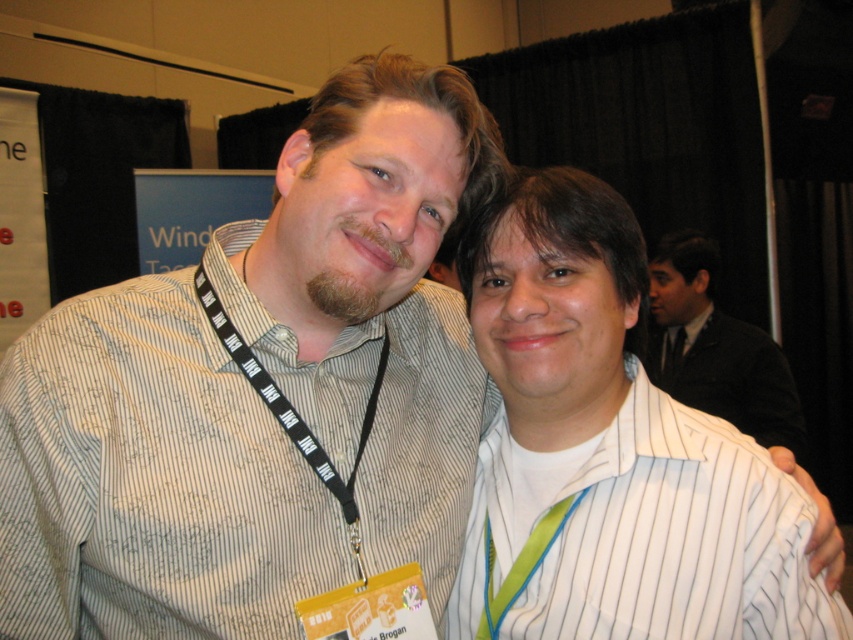
You are a photographer standing 1 meter away from the striped cotton shirt at center. Can you take a clear photo of it without moving closer?

The striped cotton shirt at center is 26.85 inches away from the viewer. Since 26.85 inches is approximately 0.68 meters, and you are already 1 meter away, you need to move closer to capture a clear photo.

You are a photographer at the event and want to ensure both subjects are fully visible in the photo. Is the striped cotton shirt at center overlapping with the black suit jacket at upper right?

The striped cotton shirt at center is positioned under the black suit jacket at upper right, so yes, the striped cotton shirt at center is overlapping with the black suit jacket at upper right.